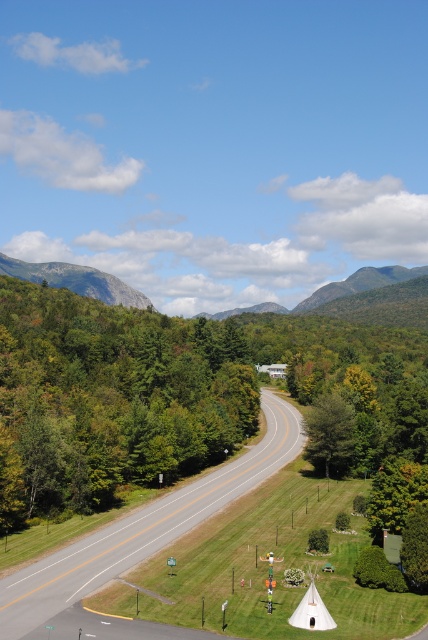
Question: Does green leafy tree at left have a larger size compared to asphalt road at center?

Choices:
 (A) no
 (B) yes

Answer: (B)

Question: Can you confirm if green leafy tree at left is positioned below green matte tree at center?

Choices:
 (A) yes
 (B) no

Answer: (B)

Question: Does green leafy tree at left lie behind green matte tree at center?

Choices:
 (A) no
 (B) yes

Answer: (A)

Question: Which object is farther from the camera taking this photo?

Choices:
 (A) gray rock formation at upper left
 (B) asphalt road at center
 (C) green leafy tree at left
 (D) green matte tree at center

Answer: (A)

Question: Which is farther from the gray rock formation at upper left?

Choices:
 (A) green leafy tree at left
 (B) green matte tree at center

Answer: (B)

Question: Which point is closer to the camera?

Choices:
 (A) (59, 272)
 (B) (336, 456)
 (C) (116, 339)
 (D) (39, 563)

Answer: (D)